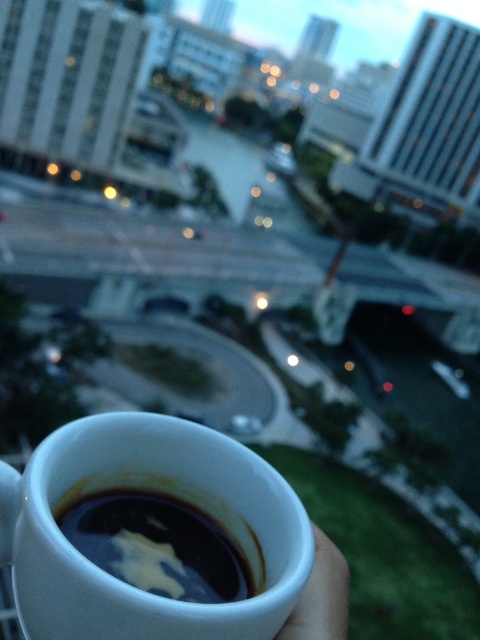
Does white glossy mug at lower center appear under black glossy coffee cup at lower center?

Actually, white glossy mug at lower center is above black glossy coffee cup at lower center.

Is point (14, 470) behind point (104, 532)?

Yes, it is.

Between point (239, 513) and point (68, 524), which one is positioned in front?

Point (68, 524)

Where is `white glossy mug at lower center`? The width and height of the screenshot is (480, 640). white glossy mug at lower center is located at coordinates (169, 492).